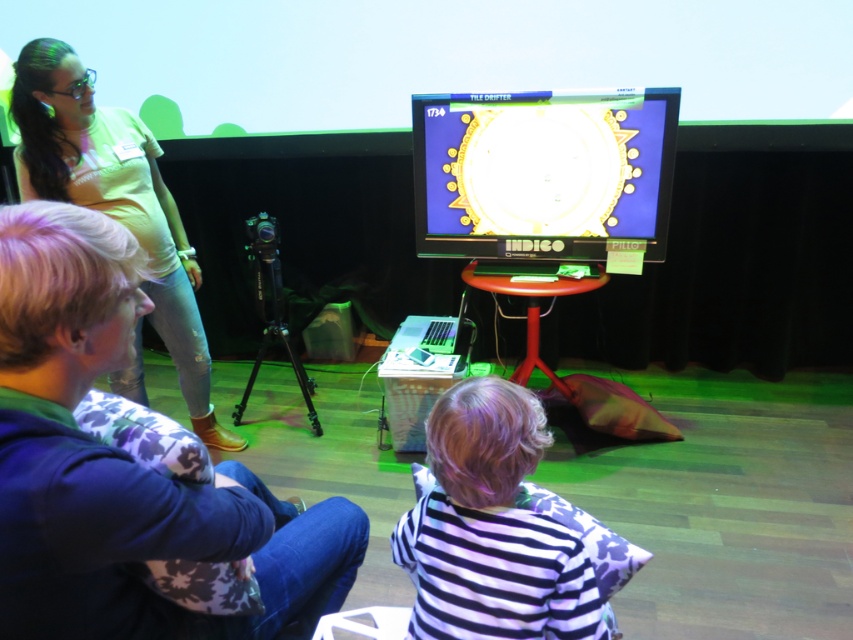
Question: Considering the real-world distances, which object is closest to the striped fabric shirt at center?

Choices:
 (A) light beige cotton shirt at upper left
 (B) matte plastic monitor at center

Answer: (B)

Question: Which object is closer to the camera taking this photo?

Choices:
 (A) matte plastic monitor at center
 (B) striped fabric shirt at center
 (C) light beige cotton shirt at upper left

Answer: (B)

Question: Which of the following is the closest to the observer?

Choices:
 (A) (511, 557)
 (B) (492, 100)
 (C) (184, 237)

Answer: (A)

Question: Does matte plastic monitor at center have a larger size compared to striped fabric shirt at center?

Choices:
 (A) no
 (B) yes

Answer: (B)

Question: Does striped fabric shirt at center appear under light beige cotton shirt at upper left?

Choices:
 (A) no
 (B) yes

Answer: (B)

Question: Is striped fabric shirt at center above light beige cotton shirt at upper left?

Choices:
 (A) yes
 (B) no

Answer: (B)